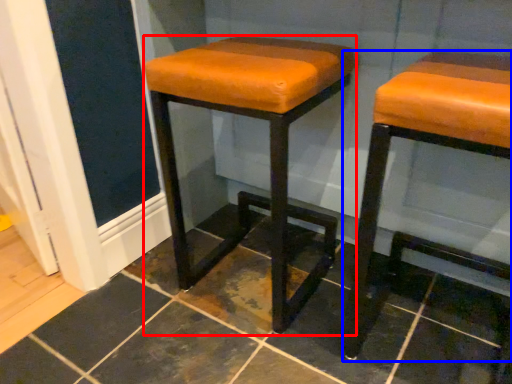
Question: Among these objects, which one is nearest to the camera, stool (highlighted by a red box) or stool (highlighted by a blue box)?

Choices:
 (A) stool
 (B) stool

Answer: (B)